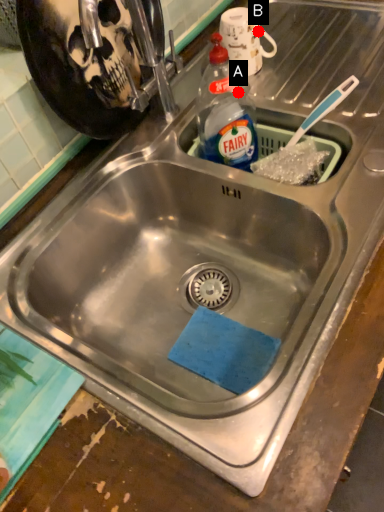
Question: Two points are circled on the image, labeled by A and B beside each circle. Which point is closer to the camera?

Choices:
 (A) A is closer
 (B) B is closer

Answer: (A)